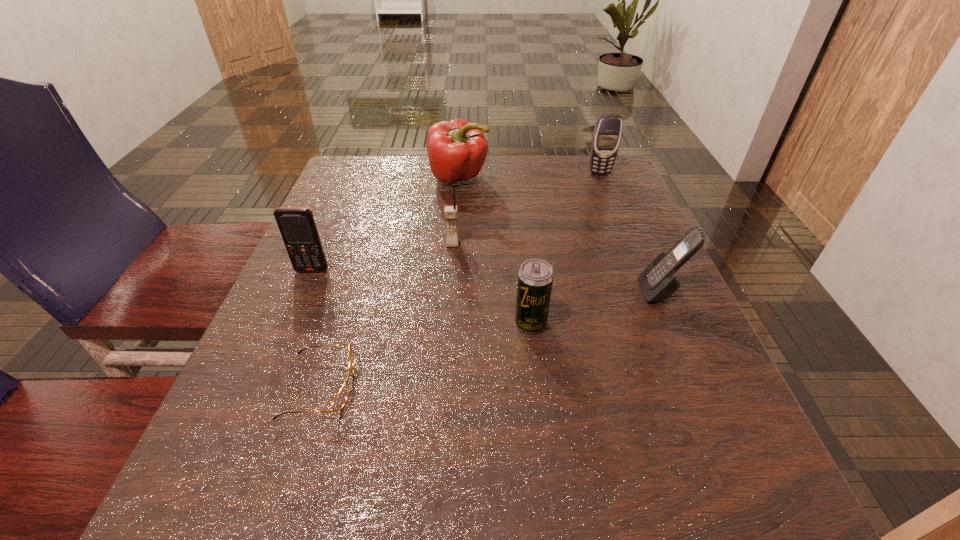
I want to click on empty location between the nearest cellular telephone and the nearest object, so click(x=490, y=339).

You are a GUI agent. You are given a task and a screenshot of the screen. Output one action in this format:
    pyautogui.click(x=<x>, y=<y>)
    Task: Click on the third closest object relative to the third nearest object
    This screenshot has height=540, width=960.
    Given the screenshot: What is the action you would take?
    pyautogui.click(x=607, y=133)

Identify which object is the fifth closest to the farthest cellular telephone. Please provide its 2D coordinates. Your answer should be formatted as a tuple, i.e. [(x, y)], where the tuple contains the x and y coordinates of a point satisfying the conditions above.

[(297, 226)]

Point out which cellular telephone is positioned as the third nearest to the fifth farthest object. Please provide its 2D coordinates. Your answer should be formatted as a tuple, i.e. [(x, y)], where the tuple contains the x and y coordinates of a point satisfying the conditions above.

[(297, 226)]

Locate an element on the screen. The height and width of the screenshot is (540, 960). cellular telephone that is the closest to the bell pepper is located at coordinates (450, 212).

You are a GUI agent. You are given a task and a screenshot of the screen. Output one action in this format:
    pyautogui.click(x=<x>, y=<y>)
    Task: Click on the free space that satisfies the following two spatial constraints: 1. on the front side of the bell pepper; 2. on the front-facing side of the nearest object
    The width and height of the screenshot is (960, 540).
    Given the screenshot: What is the action you would take?
    pyautogui.click(x=444, y=386)

Where is `free region that satisfies the following two spatial constraints: 1. on the front side of the bell pepper; 2. on the front-facing side of the sixth object from right to left`? Image resolution: width=960 pixels, height=540 pixels. free region that satisfies the following two spatial constraints: 1. on the front side of the bell pepper; 2. on the front-facing side of the sixth object from right to left is located at coordinates (444, 386).

Identify the location of free space that satisfies the following two spatial constraints: 1. on the front of the second farthest cellular telephone, where the keypad is located; 2. on the right side of the beer can. The height and width of the screenshot is (540, 960). (446, 323).